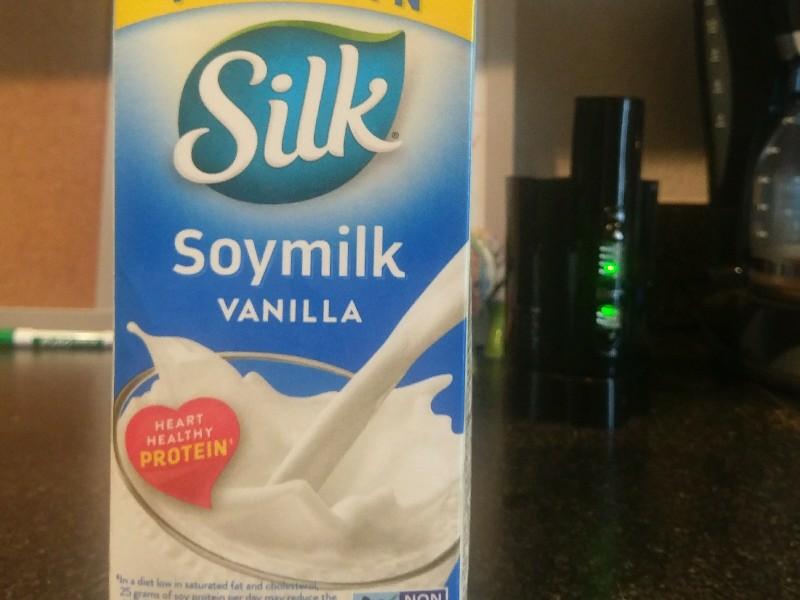
Find the location of a particular element. This screenshot has height=600, width=800. green light is located at coordinates (610, 270), (606, 309).